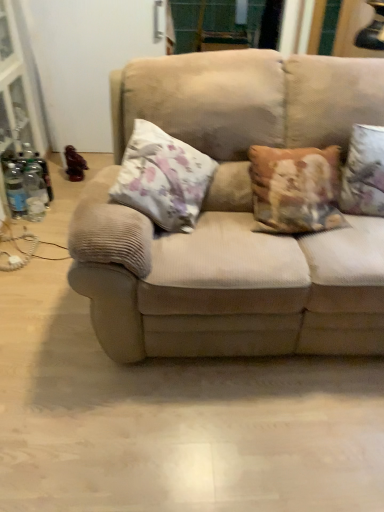
Where is `blank area to the left of wooden statue at left`? blank area to the left of wooden statue at left is located at coordinates (59, 175).